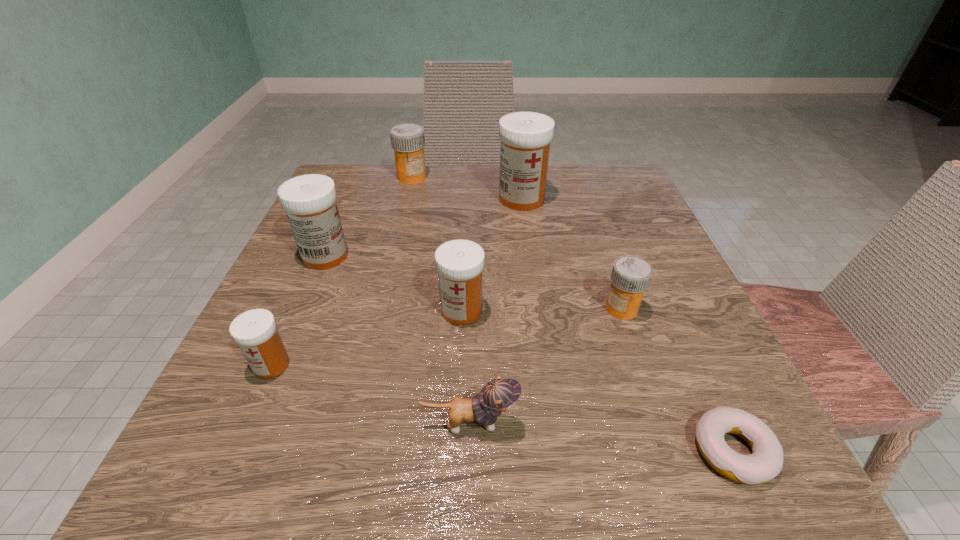
The height and width of the screenshot is (540, 960). Identify the location of object located at the near right corner. (766, 461).

Where is `vacant space at the far edge`? Image resolution: width=960 pixels, height=540 pixels. vacant space at the far edge is located at coordinates (492, 195).

Locate an element on the screen. vacant space at the near edge is located at coordinates (322, 460).

This screenshot has height=540, width=960. In order to click on free spot at the left edge of the desktop in this screenshot , I will do `click(327, 307)`.

Find the location of `vacant space at the right edge of the desktop`. vacant space at the right edge of the desktop is located at coordinates (609, 238).

The image size is (960, 540). In order to click on free space at the far left corner of the desktop in this screenshot , I will do `click(361, 172)`.

Where is `vacant area between the sixth farthest object and the second tallest medicine`? This screenshot has height=540, width=960. vacant area between the sixth farthest object and the second tallest medicine is located at coordinates (299, 310).

Locate an element on the screen. vacant area that lies between the third white medicine from left to right and the shortest object is located at coordinates (597, 381).

Identify the location of blank region between the second farthest medicine and the seventh shortest object. (423, 227).

The width and height of the screenshot is (960, 540). What are the coordinates of `empty space that is in between the third smallest white medicine and the kitten` in the screenshot? It's located at (397, 340).